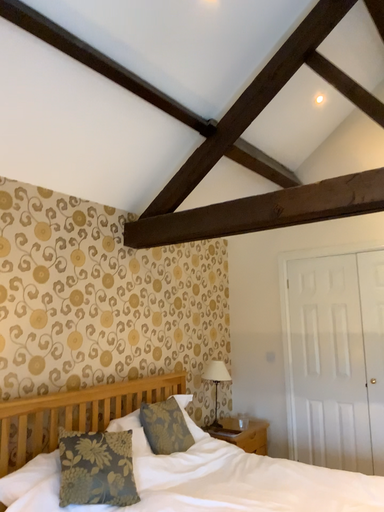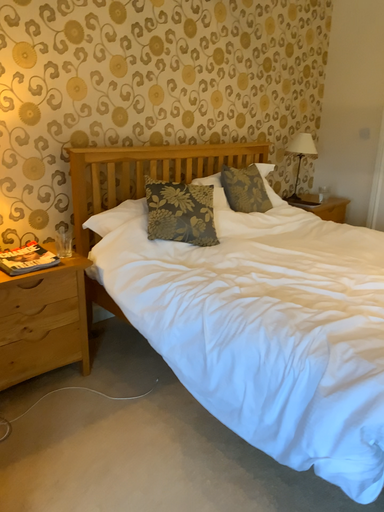
Question: Which way did the camera rotate in the video?

Choices:
 (A) rotated right
 (B) rotated left

Answer: (B)